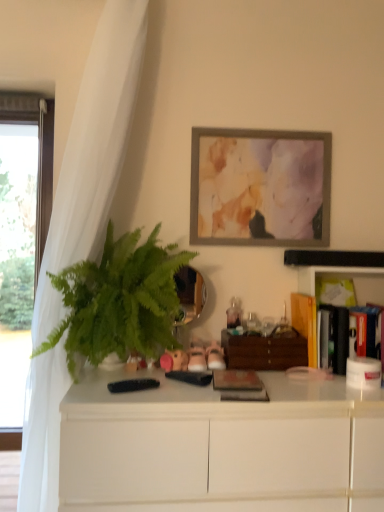
Question: Is pink fabric stuffed animal at center in front of or behind green leafy plant at left in the image?

Choices:
 (A) behind
 (B) front

Answer: (A)

Question: Choose the correct answer: Is pink fabric stuffed animal at center inside green leafy plant at left or outside it?

Choices:
 (A) inside
 (B) outside

Answer: (A)

Question: Which object is the closest to the white matte cabinet at center?

Choices:
 (A) white sheer curtain at left
 (B) green leafy plant at left
 (C) pink fabric stuffed animal at center
 (D) wooden drawer at center
 (E) hardcover book at right, which appears as the 2th book when viewed from the front

Answer: (B)

Question: Which object is the farthest from the green leafy plant at left?

Choices:
 (A) white matte cabinet at center
 (B) wooden drawer at center
 (C) matte gray picture frame at upper center
 (D) hardcover book at right, arranged as the second book when viewed from the back
 (E) pink fabric stuffed animal at center

Answer: (D)